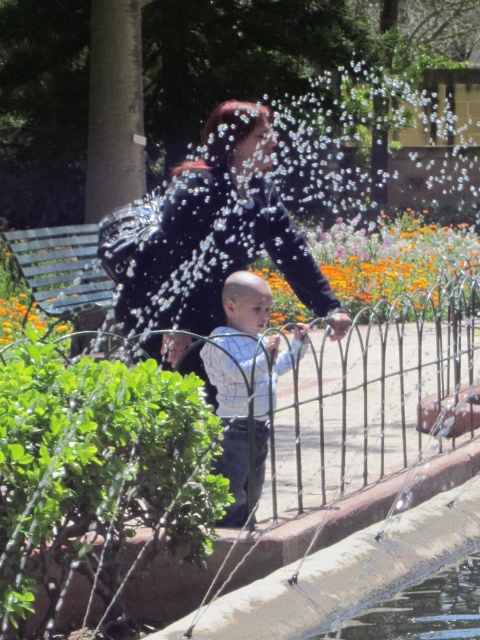
Question: Can you confirm if matte black jacket at center is bigger than green metal bench at left?

Choices:
 (A) yes
 (B) no

Answer: (A)

Question: Is matte black jacket at center smaller than light blue striped shirt at center?

Choices:
 (A) no
 (B) yes

Answer: (A)

Question: Which is nearer to the light blue striped shirt at center?

Choices:
 (A) green metal bench at left
 (B) matte black jacket at center

Answer: (B)

Question: Does matte black jacket at center appear over green metal bench at left?

Choices:
 (A) no
 (B) yes

Answer: (A)

Question: Which object is closer to the camera taking this photo?

Choices:
 (A) green metal bench at left
 (B) matte black jacket at center
 (C) light blue striped shirt at center

Answer: (C)

Question: Based on their relative distances, which object is nearer to the light blue striped shirt at center?

Choices:
 (A) matte black jacket at center
 (B) green metal bench at left

Answer: (A)